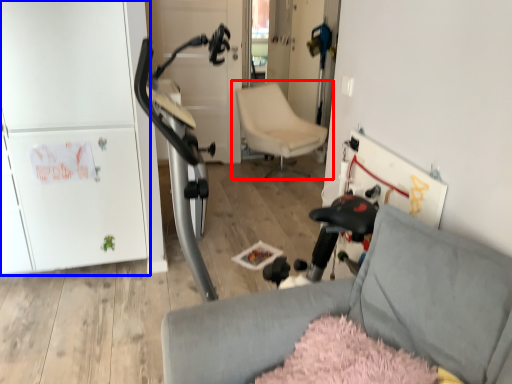
Question: Which of the following is the farthest to the observer, chair (highlighted by a red box) or fridge (highlighted by a blue box)?

Choices:
 (A) chair
 (B) fridge

Answer: (A)